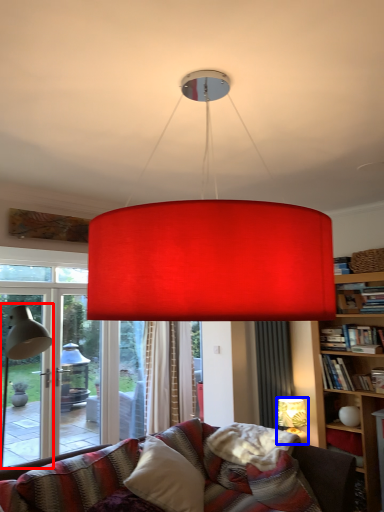
Question: Which object appears farthest to the camera in this image, table lamp (highlighted by a red box) or lamp (highlighted by a blue box)?

Choices:
 (A) table lamp
 (B) lamp

Answer: (B)